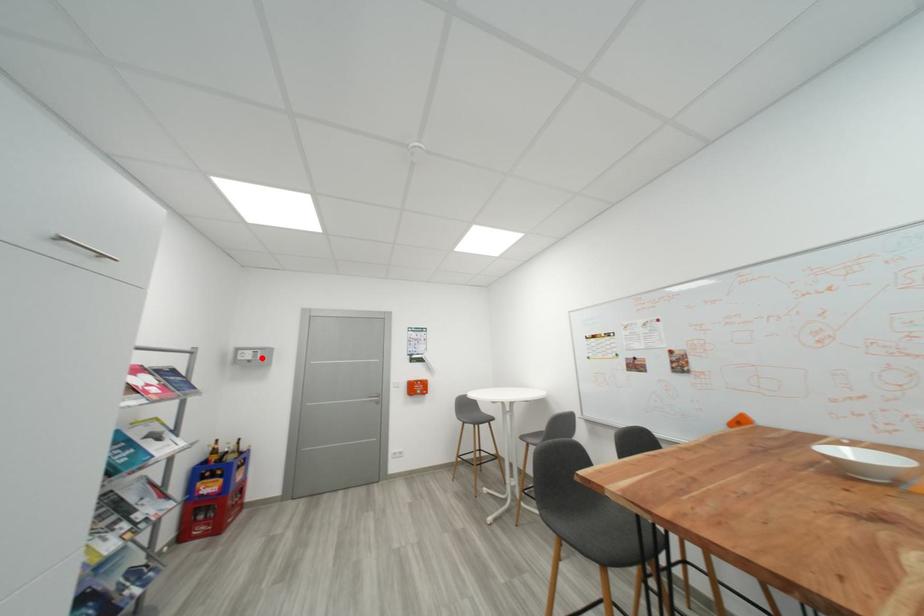
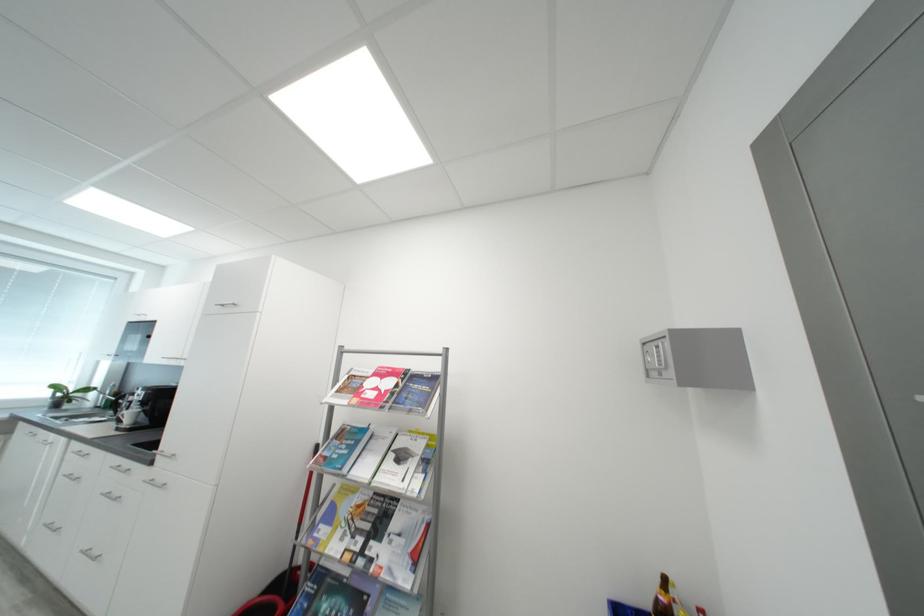
Find the pixel in the second image that matches the highlighted location in the first image.

(666, 362)